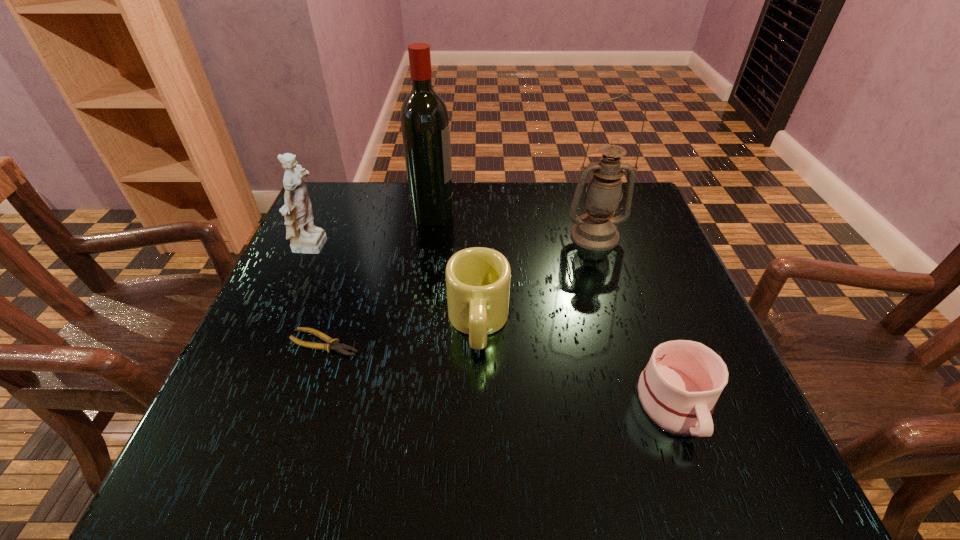
This screenshot has height=540, width=960. I want to click on free space between the nearer mug and the oil lamp, so click(635, 320).

You are a GUI agent. You are given a task and a screenshot of the screen. Output one action in this format:
    pyautogui.click(x=<x>, y=<y>)
    Task: Click on the vacant area between the fourth object from left to right and the second shortest object
    This screenshot has width=960, height=540.
    Given the screenshot: What is the action you would take?
    pyautogui.click(x=576, y=364)

Locate an element on the screen. This screenshot has width=960, height=540. vacant area between the third tallest object and the fourth object from left to right is located at coordinates (396, 286).

Locate an element on the screen. Image resolution: width=960 pixels, height=540 pixels. unoccupied position between the wine bottle and the figurine is located at coordinates (373, 231).

You are a GUI agent. You are given a task and a screenshot of the screen. Output one action in this format:
    pyautogui.click(x=<x>, y=<y>)
    Task: Click on the blank region between the farther mug and the oil lamp
    The height and width of the screenshot is (540, 960).
    Given the screenshot: What is the action you would take?
    pyautogui.click(x=537, y=279)

You are a GUI agent. You are given a task and a screenshot of the screen. Output one action in this format:
    pyautogui.click(x=<x>, y=<y>)
    Task: Click on the vacant region between the shortest object and the figurine
    The height and width of the screenshot is (540, 960).
    Given the screenshot: What is the action you would take?
    pyautogui.click(x=320, y=296)

Locate an element on the screen. The height and width of the screenshot is (540, 960). free space between the wine bottle and the shortest object is located at coordinates click(379, 278).

The height and width of the screenshot is (540, 960). I want to click on object that is the fourth nearest to the wine bottle, so click(x=332, y=344).

At what (x,y) coordinates should I click in order to perform the action: click on object that stands as the fourth closest to the figurine. Please return your answer as a coordinate pair (x, y). This screenshot has width=960, height=540. Looking at the image, I should click on (596, 230).

The image size is (960, 540). In order to click on vacant space that satisfies the following two spatial constraints: 1. on the label of the second tallest object; 2. on the right side of the fourth object from right to left in this screenshot , I will do `click(430, 236)`.